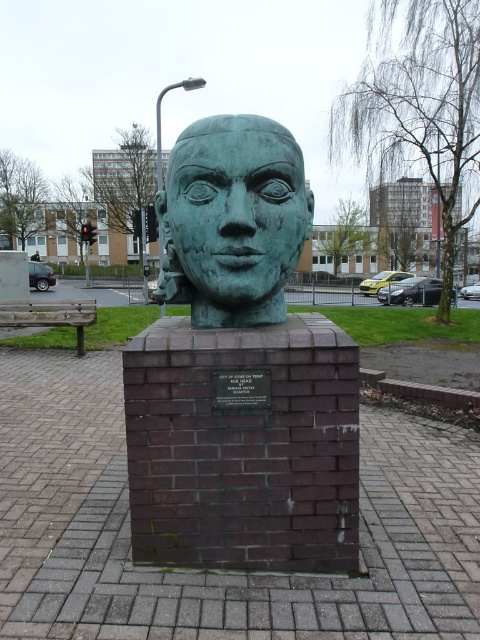
Question: Which object is farther from the camera taking this photo?

Choices:
 (A) green patina stone head at center
 (B) green patina head at center

Answer: (B)

Question: Among these objects, which one is farthest from the camera?

Choices:
 (A) green patina head at center
 (B) green patina stone head at center

Answer: (A)

Question: Observing the image, what is the correct spatial positioning of green patina stone head at center in reference to green patina head at center?

Choices:
 (A) above
 (B) below

Answer: (B)

Question: Is green patina stone head at center below green patina head at center?

Choices:
 (A) no
 (B) yes

Answer: (B)

Question: Can you confirm if green patina stone head at center is positioned to the left of green patina head at center?

Choices:
 (A) no
 (B) yes

Answer: (A)